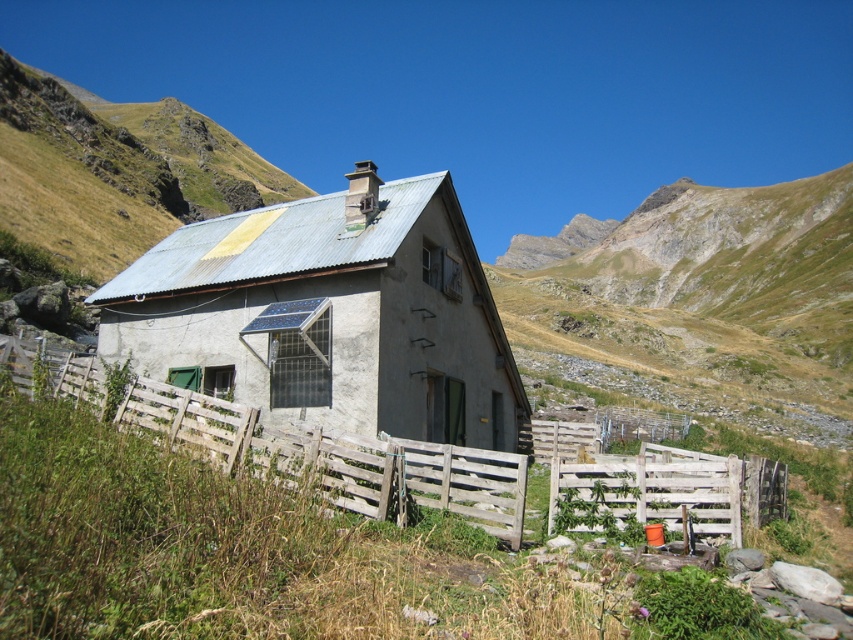
Can you confirm if rusty metal cottage at center is positioned to the right of wooden at center?

No, rusty metal cottage at center is not to the right of wooden at center.

Which is below, rusty metal cottage at center or wooden at center?

wooden at center

At what (x,y) coordinates should I click in order to perform the action: click on rusty metal cottage at center. Please return your answer as a coordinate pair (x, y). The height and width of the screenshot is (640, 853). Looking at the image, I should click on (329, 314).

Locate an element on the screen. The image size is (853, 640). rusty metal cottage at center is located at coordinates (329, 314).